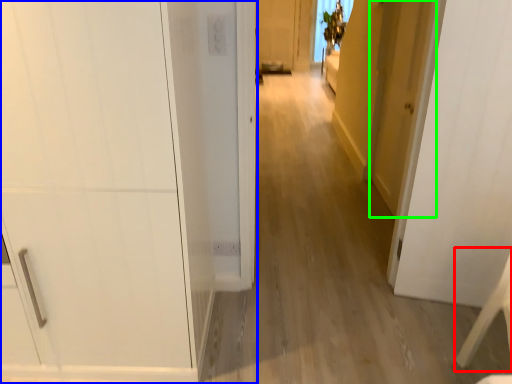
Question: Which object is positioned farthest from furniture (highlighted by a red box)? Select from door (highlighted by a blue box) and door (highlighted by a green box).

Choices:
 (A) door
 (B) door

Answer: (A)